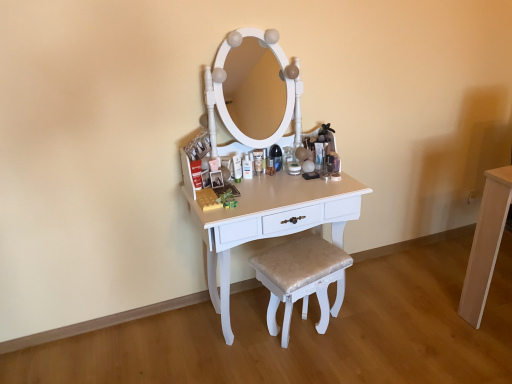
Question: Considering the relative positions of shiny beige cushioned stool at center and matte white lotion at center in the image provided, is shiny beige cushioned stool at center to the left or to the right of matte white lotion at center?

Choices:
 (A) left
 (B) right

Answer: (B)

Question: Relative to matte white lotion at center, is shiny beige cushioned stool at center in front or behind?

Choices:
 (A) front
 (B) behind

Answer: (A)

Question: Which object is positioned farthest from the matte white lotion at center?

Choices:
 (A) shiny beige cushioned stool at center
 (B) white glossy table at center, the 2th table in the right-to-left sequence
 (C) light wood cabinet at right, the 2th table when ordered from left to right

Answer: (C)

Question: Considering the real-world distances, which object is closest to the white glossy table at center, the 2th table in the right-to-left sequence?

Choices:
 (A) shiny beige cushioned stool at center
 (B) matte white lotion at center
 (C) light wood cabinet at right, the 2th table when ordered from left to right

Answer: (A)